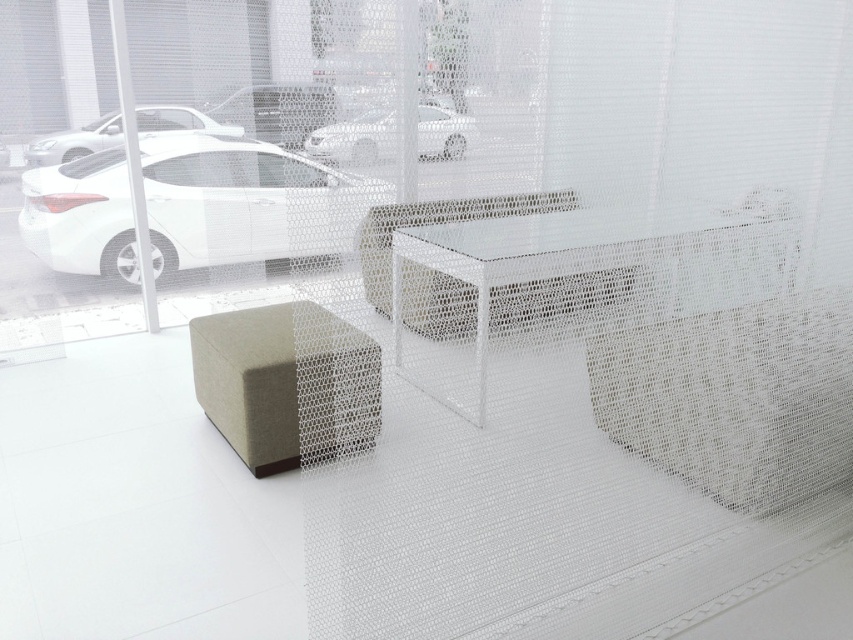
Question: Which point is closer to the camera?

Choices:
 (A) pyautogui.click(x=561, y=227)
 (B) pyautogui.click(x=212, y=406)
 (C) pyautogui.click(x=328, y=115)
 (D) pyautogui.click(x=329, y=129)

Answer: (C)

Question: Can you confirm if textured beige stool at center is thinner than white glossy car at upper left?

Choices:
 (A) no
 (B) yes

Answer: (B)

Question: Which point is farther to the camera?

Choices:
 (A) (30, 141)
 (B) (265, 104)
 (C) (345, 372)

Answer: (A)

Question: Can you confirm if textured beige stool at center is bigger than white glossy car at upper left?

Choices:
 (A) yes
 (B) no

Answer: (A)

Question: Does white matte car at left have a greater width compared to white glossy car at upper center?

Choices:
 (A) yes
 (B) no

Answer: (A)

Question: Among these points, which one is nearest to the camera?

Choices:
 (A) (730, 269)
 (B) (434, 106)
 (C) (151, 216)

Answer: (B)